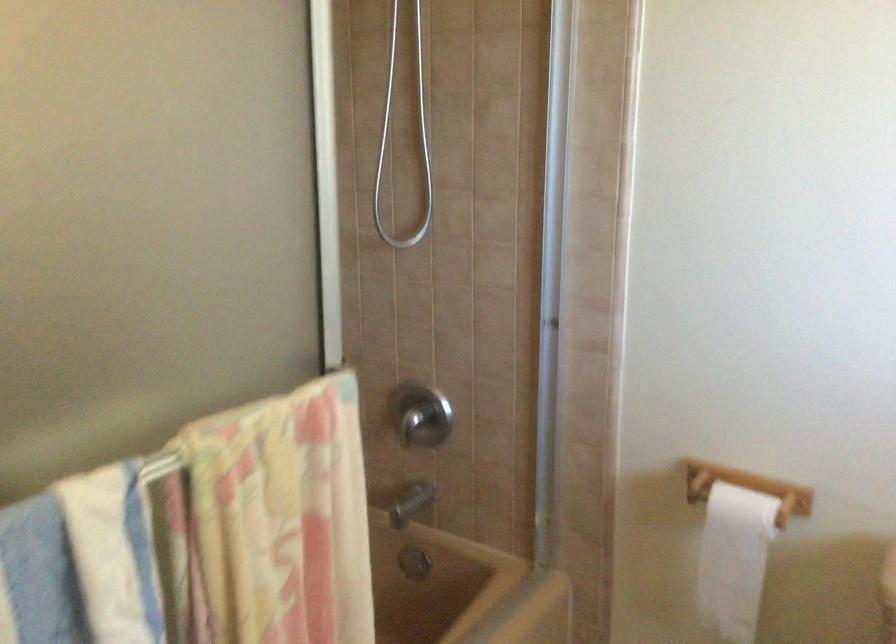
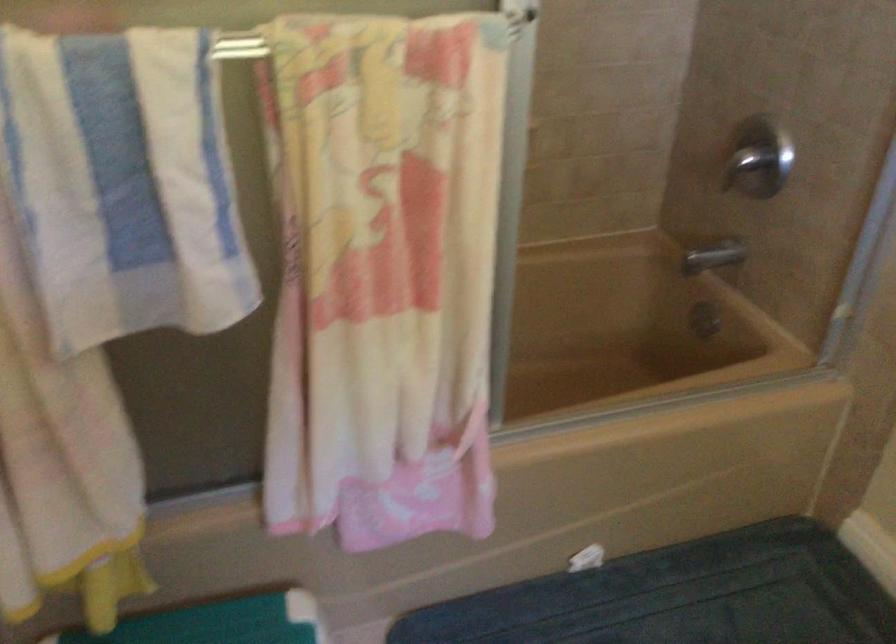
Based on the continuous images, in which direction is the camera rotating?

The camera's rotation is toward left-down.